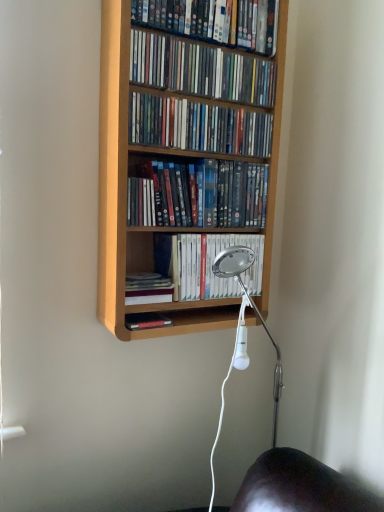
Question: Looking at their shapes, would you say matte plastic dvds at center, positioned as the 4th book in top-to-bottom order, is wider or thinner than hardcover book at center, arranged as the 1th book when ordered from the bottom?

Choices:
 (A) wide
 (B) thin

Answer: (B)

Question: Considering the positions of matte plastic dvds at center, positioned as the 4th book in top-to-bottom order, and hardcover book at center, marked as the sixth book in a top-to-bottom arrangement, in the image, is matte plastic dvds at center, positioned as the 4th book in top-to-bottom order, taller or shorter than hardcover book at center, marked as the sixth book in a top-to-bottom arrangement,?

Choices:
 (A) short
 (B) tall

Answer: (B)

Question: Which object is positioned farthest from the matte plastic dvds at upper center, the first book positioned from the top?

Choices:
 (A) matte plastic dvds at upper center, which ranks as the third book in top-to-bottom order
 (B) matte plastic dvds at center, positioned as the 4th book in top-to-bottom order
 (C) matte plastic dvds at upper center, which appears as the second book when viewed from the top
 (D) light wood bookcase at center
 (E) hardcover book at center, marked as the sixth book in a top-to-bottom arrangement

Answer: (E)

Question: Based on their relative distances, which object is farther from the white glossy book at center, acting as the second book starting from the bottom?

Choices:
 (A) hardcover book at center, arranged as the 1th book when ordered from the bottom
 (B) matte plastic dvds at upper center, which ranks as the third book in top-to-bottom order
 (C) matte plastic dvds at upper center, which appears as the second book when viewed from the top
 (D) matte plastic dvds at center, positioned as the 4th book in top-to-bottom order
 (E) light wood bookcase at center

Answer: (C)